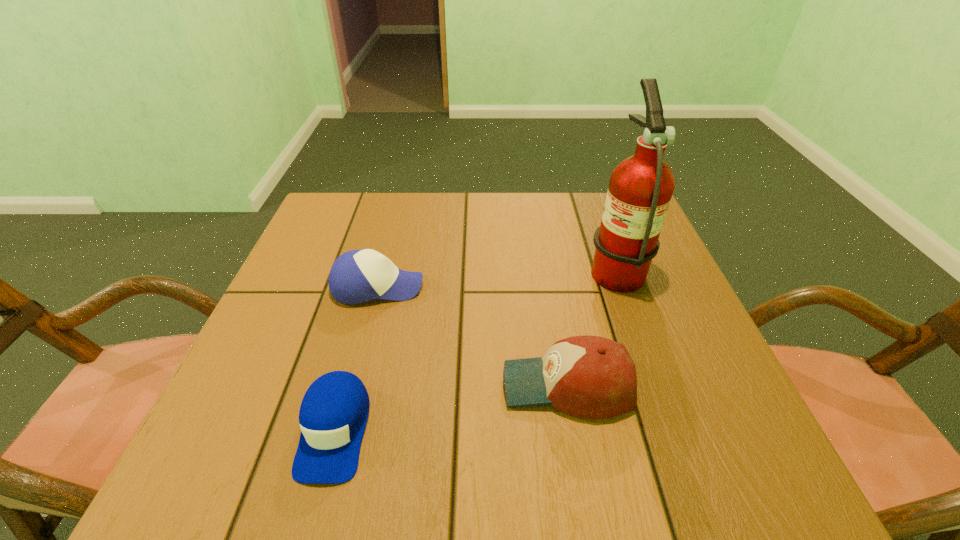
Locate an element on the screen. Image resolution: width=960 pixels, height=540 pixels. free space located on the front-facing side of the rightmost baseball cap is located at coordinates (394, 386).

This screenshot has height=540, width=960. Identify the location of vacant space situated on the front-facing side of the farthest baseball cap. (524, 287).

Find the location of `object at the far edge`. object at the far edge is located at coordinates click(640, 189).

Where is `object at the near edge`? object at the near edge is located at coordinates (333, 414).

Identify the location of object present at the right edge. The image size is (960, 540). (640, 189).

Locate an element on the screen. Image resolution: width=960 pixels, height=540 pixels. object located at the near left corner is located at coordinates (333, 414).

Find the location of `object present at the far right corner`. object present at the far right corner is located at coordinates (640, 189).

Image resolution: width=960 pixels, height=540 pixels. In the image, there is a desktop. What are the coordinates of `free space at the far edge` in the screenshot? It's located at (434, 210).

In the image, there is a desktop. Where is `vacant space at the near edge`? vacant space at the near edge is located at coordinates (435, 485).

Locate an element on the screen. The height and width of the screenshot is (540, 960). vacant space at the right edge is located at coordinates (671, 339).